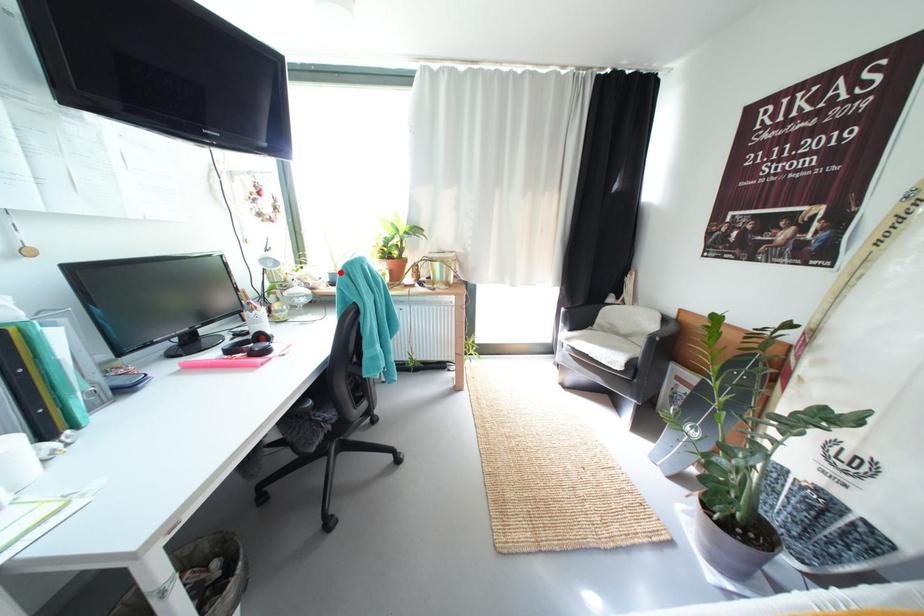
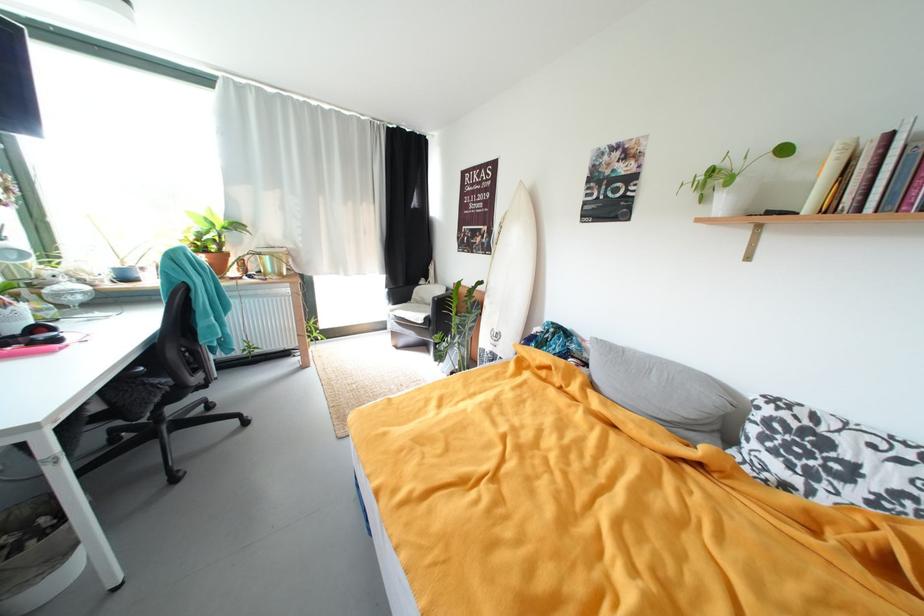
In the second image, find the point that corresponds to the highlighted location in the first image.

(127, 268)